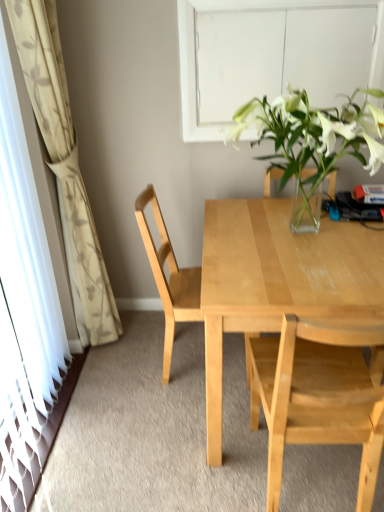
I want to click on blank area to the left of light wood desk at center, so click(x=135, y=417).